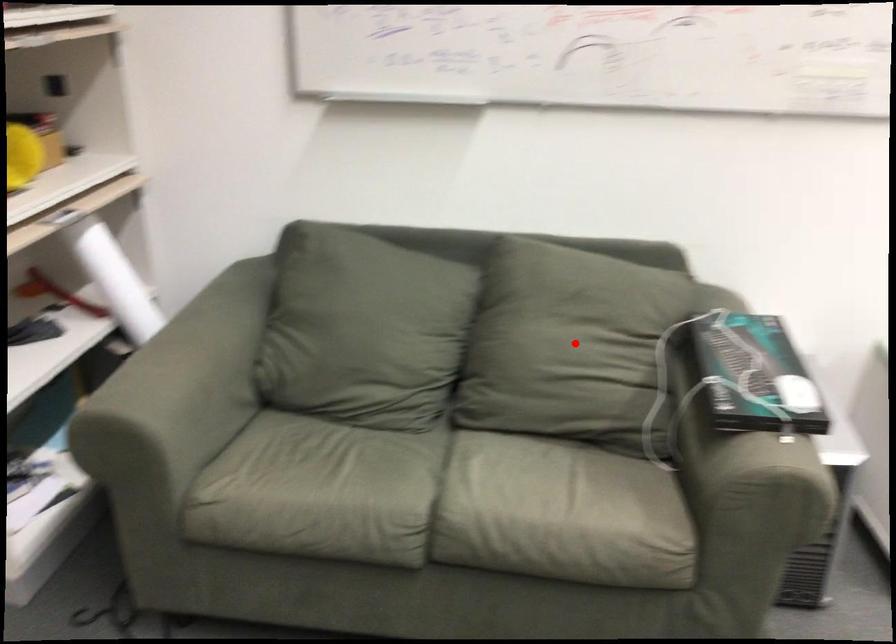
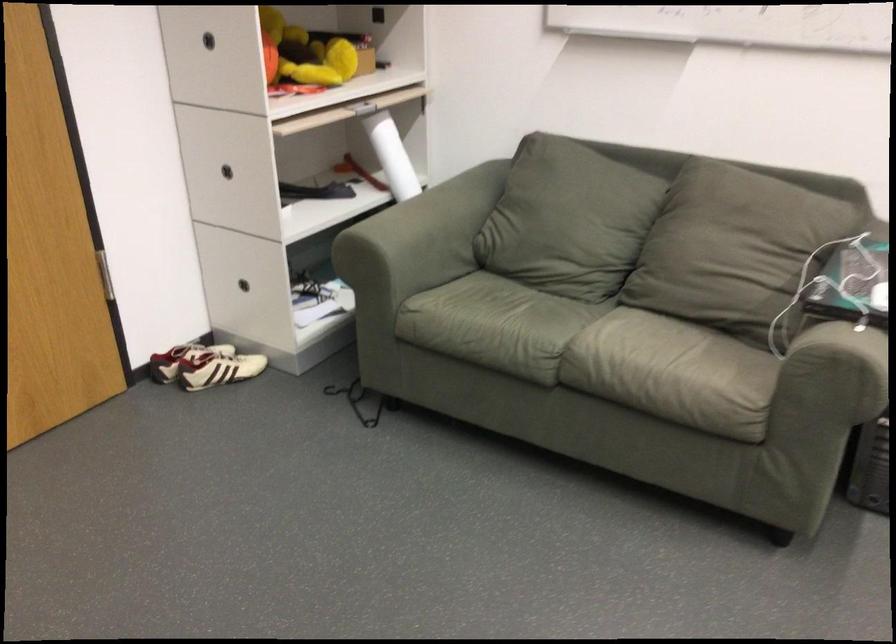
Find the pixel in the second image that matches the highlighted location in the first image.

(728, 243)